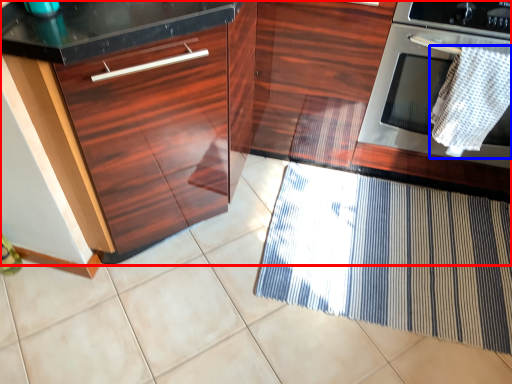
Question: Which point is closer to the camera, cabinetry (highlighted by a red box) or blanket (highlighted by a blue box)?

Choices:
 (A) cabinetry
 (B) blanket

Answer: (A)